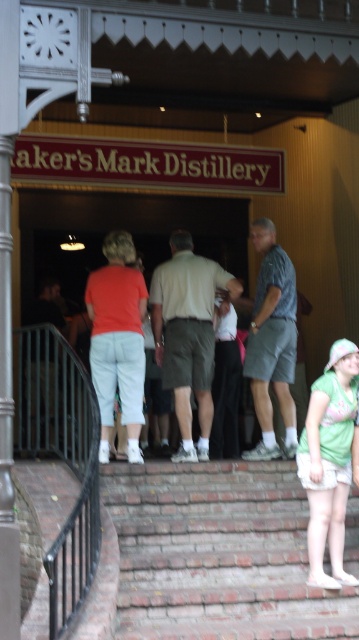
Is black metal railing at lower left in front of matte gray shirt at center?

Yes, it is in front of matte gray shirt at center.

Is black metal railing at lower left to the left of matte gray shirt at center from the viewer's perspective?

No, black metal railing at lower left is not to the left of matte gray shirt at center.

The image size is (359, 640). I want to click on black metal railing at lower left, so click(x=62, y=458).

Locate an element on the screen. The width and height of the screenshot is (359, 640). black metal railing at lower left is located at coordinates (62, 458).

Between brick stairs at center and matte coral blouse at center, which one is positioned higher?

matte coral blouse at center is higher up.

Is brick stairs at center smaller than matte coral blouse at center?

Actually, brick stairs at center might be larger than matte coral blouse at center.

What do you see at coordinates (217, 554) in the screenshot?
I see `brick stairs at center` at bounding box center [217, 554].

I want to click on brick stairs at center, so click(x=217, y=554).

Does matte coral blouse at center have a smaller size compared to matte gray shirt at center?

Yes.

Between matte coral blouse at center and matte gray shirt at center, which one has more height?

With more height is matte coral blouse at center.

Between point (140, 346) and point (39, 412), which one is positioned in front?

Point (140, 346) is in front.

At what (x,y) coordinates should I click in order to perform the action: click on matte coral blouse at center. Please return your answer as a coordinate pair (x, y). Looking at the image, I should click on (x=118, y=339).